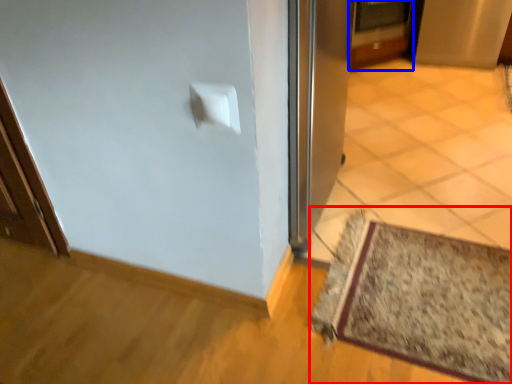
Question: Which object is closer to the camera taking this photo, mat (highlighted by a red box) or door (highlighted by a blue box)?

Choices:
 (A) mat
 (B) door

Answer: (A)